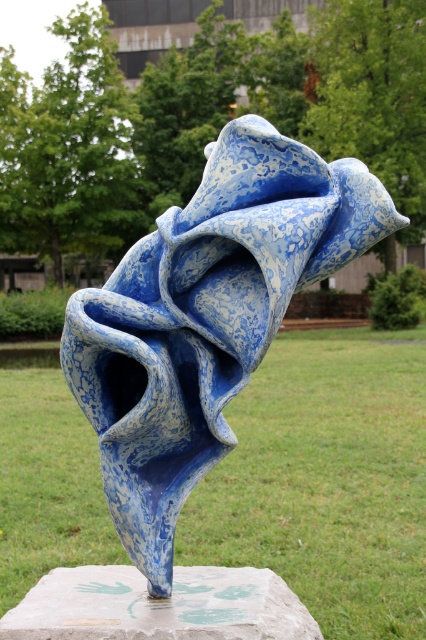
Question: Which object is the farthest from the marble stone at center?

Choices:
 (A) blue marbled stone sculpture at center
 (B) green grass at center

Answer: (B)

Question: Is green grass at center wider than marble stone at center?

Choices:
 (A) no
 (B) yes

Answer: (A)

Question: Can you confirm if blue marbled stone sculpture at center is wider than marble stone at center?

Choices:
 (A) yes
 (B) no

Answer: (A)

Question: Based on their relative distances, which object is farther from the marble stone at center?

Choices:
 (A) blue marbled stone sculpture at center
 (B) green grass at center

Answer: (B)

Question: Which point is closer to the camera?

Choices:
 (A) (161, 364)
 (B) (124, 637)

Answer: (B)

Question: Is green grass at center to the right of blue marbled stone sculpture at center from the viewer's perspective?

Choices:
 (A) yes
 (B) no

Answer: (A)